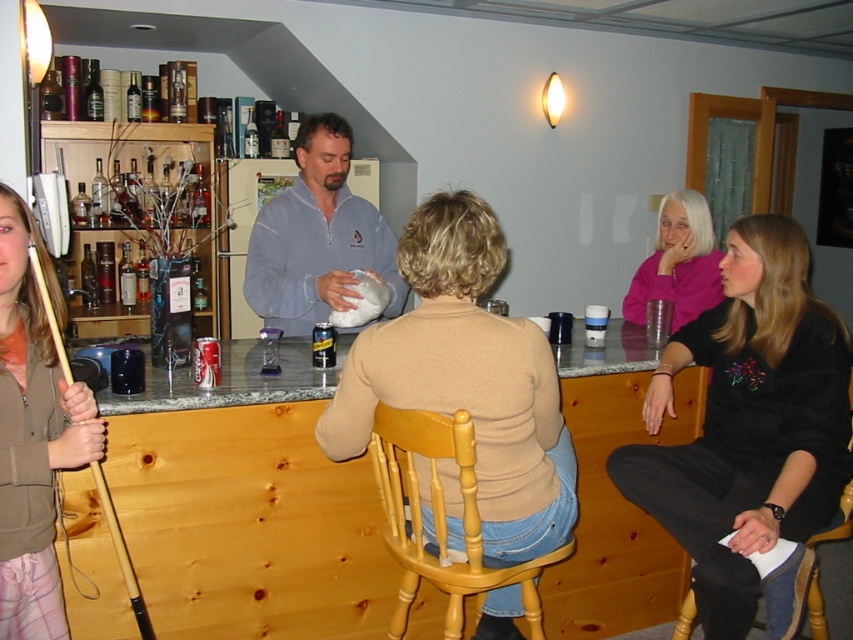
You are a guest at the bar and want to take a closer look at the black velvet sweater at upper right. Based on its coordinates, where should you move to in the room?

The black velvet sweater at upper right is located at coordinates point (747, 422), so you should move towards the upper right area of the room to get a closer look.

You are at the bar and want to move from the point at coordinates point (817, 440) to the point at coordinates point (550, 436). Which direction should you move in to get closer to the second point?

To move from point (817, 440) to point (550, 436), you should move upward because the second point is above the first point in the image.